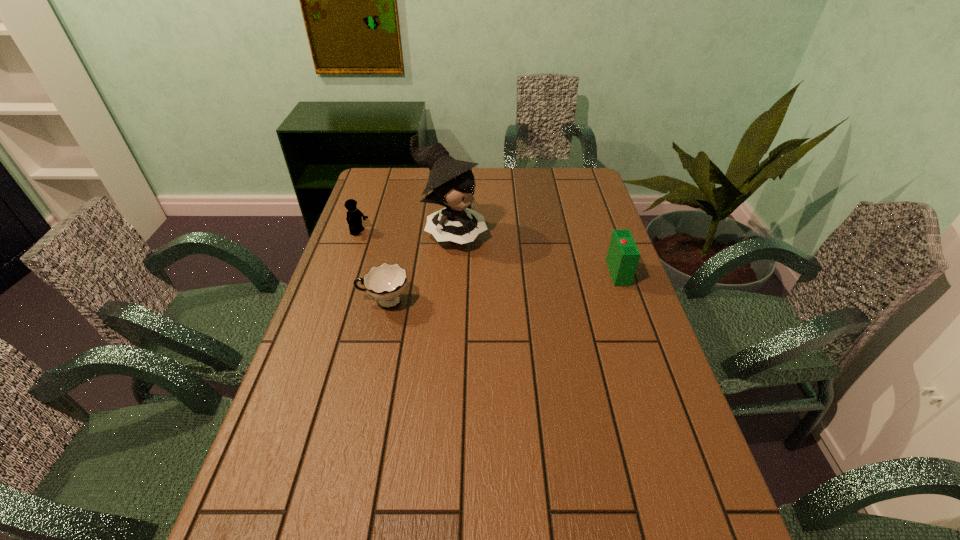
In order to click on the nearest object in this screenshot , I will do `click(386, 282)`.

This screenshot has height=540, width=960. What are the coordinates of `the shortest object` in the screenshot? It's located at (386, 282).

Identify the location of the third farthest object. The height and width of the screenshot is (540, 960). (622, 259).

Locate an element on the screen. alarm clock is located at coordinates click(622, 259).

The image size is (960, 540). Identify the location of the leftmost object. (354, 216).

The height and width of the screenshot is (540, 960). I want to click on doll, so click(452, 182).

This screenshot has width=960, height=540. What are the coordinates of `vacant area situated 0.080m on the side of the cup with the handle` in the screenshot? It's located at (330, 302).

Locate an element on the screen. vacant space located 0.070m on the side of the cup with the handle is located at coordinates (333, 302).

Identify the location of free spot located on the front-facing side of the Lego. (415, 255).

Locate an element on the screen. free space located on the front-facing side of the Lego is located at coordinates (399, 249).